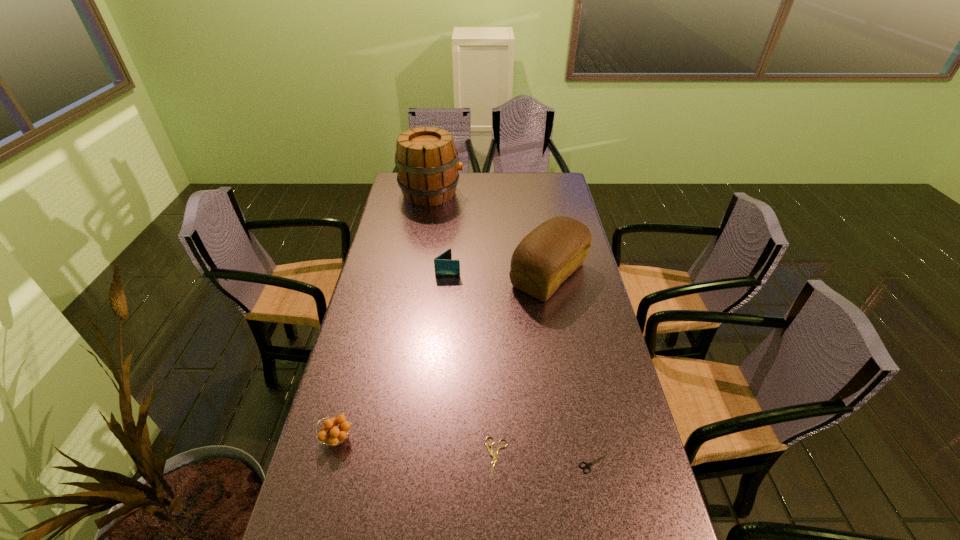
Find the location of a particular element. This screenshot has height=540, width=960. vacant space located 0.210m on the right of the third shortest object is located at coordinates (437, 438).

Where is `free space located 0.110m on the back of the fourth object from left to right`? Image resolution: width=960 pixels, height=540 pixels. free space located 0.110m on the back of the fourth object from left to right is located at coordinates (495, 400).

Locate an element on the screen. free space located 0.290m on the left of the right shears is located at coordinates (459, 464).

Identify the location of object that is at the far edge. Image resolution: width=960 pixels, height=540 pixels. (427, 163).

At what (x,y) coordinates should I click in order to perform the action: click on cider that is at the left edge. Please return your answer as a coordinate pair (x, y). This screenshot has width=960, height=540. Looking at the image, I should click on (427, 163).

Locate an element on the screen. This screenshot has height=540, width=960. orange fruit positioned at the left edge is located at coordinates (338, 434).

You are a GUI agent. You are given a task and a screenshot of the screen. Output one action in this format:
    pyautogui.click(x=<x>, y=<y>)
    Task: Click on the bread present at the right edge
    This screenshot has width=960, height=540.
    Given the screenshot: What is the action you would take?
    pyautogui.click(x=548, y=255)

Find the location of a particular element. shears situated at the right edge is located at coordinates (587, 465).

The width and height of the screenshot is (960, 540). I want to click on object located in the far left corner section of the desktop, so click(x=427, y=163).

Identify the location of vacant area at the far edge. This screenshot has width=960, height=540. (472, 184).